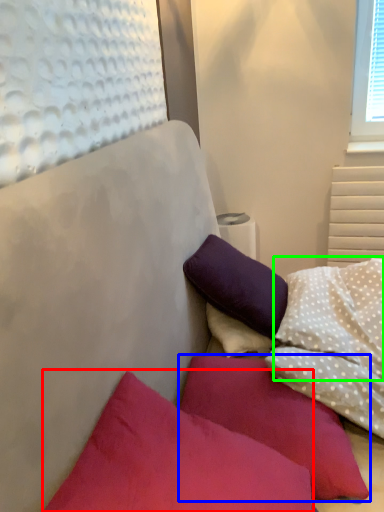
Question: Estimate the real-world distances between objects in this image. Which object is closer to pillow (highlighted by a red box), pillow (highlighted by a blue box) or pillow (highlighted by a green box)?

Choices:
 (A) pillow
 (B) pillow

Answer: (A)